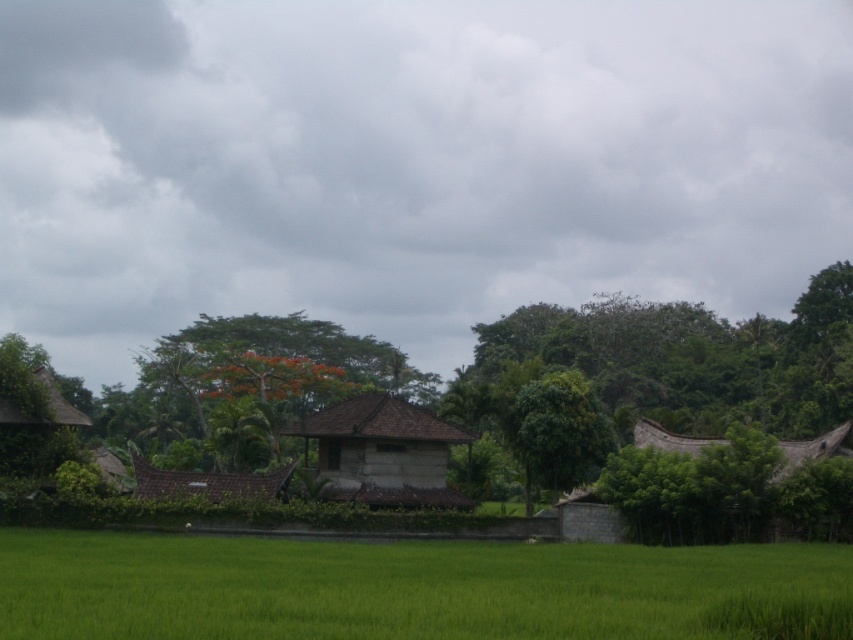
Question: Among these objects, which one is nearest to the camera?

Choices:
 (A) brown tile hut at center
 (B) green leafy tree at center

Answer: (A)

Question: Is the position of green grassy rice field at lower left less distant than that of brown tile hut at center?

Choices:
 (A) yes
 (B) no

Answer: (A)

Question: Which object is the farthest from the brown stone hut at center?

Choices:
 (A) green grassy rice field at lower left
 (B) brown thatched hut at right

Answer: (A)

Question: Is brown stone hut at center wider than brown thatched hut at right?

Choices:
 (A) no
 (B) yes

Answer: (B)

Question: Which of the following is the farthest from the observer?

Choices:
 (A) (135, 465)
 (B) (428, 499)

Answer: (B)

Question: Is brown stone hut at center to the left of brown tile hut at center from the viewer's perspective?

Choices:
 (A) yes
 (B) no

Answer: (B)